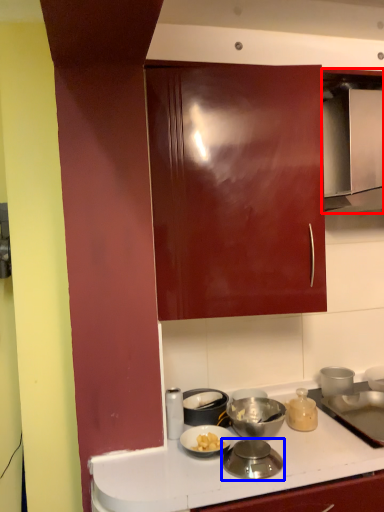
Question: Which point is further to the camera, home appliance (highlighted by a red box) or kitchen appliance (highlighted by a blue box)?

Choices:
 (A) home appliance
 (B) kitchen appliance

Answer: (A)